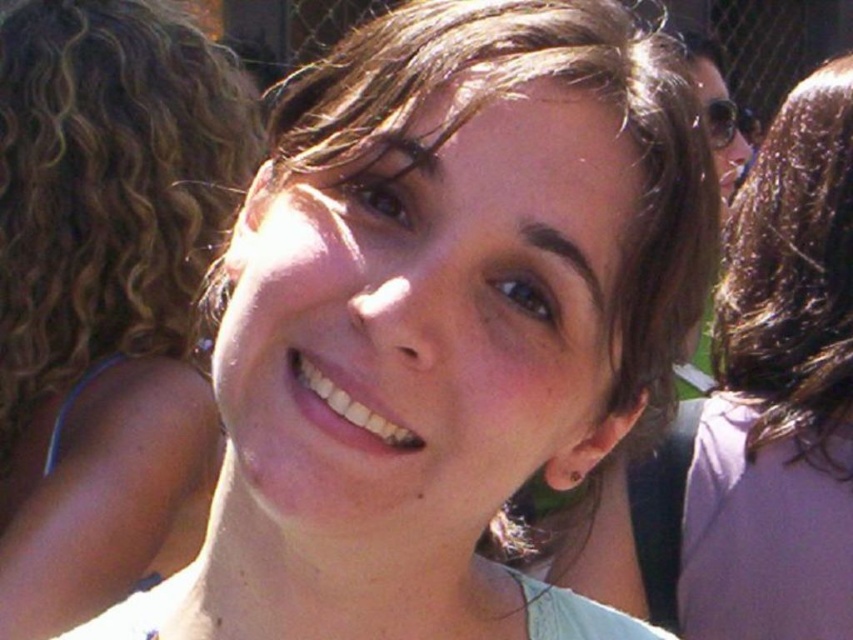
You are a photographer adjusting your camera settings to focus on the matte skin at center and the smooth brown hair at center. Which object should you focus on first to ensure proper depth of field?

The matte skin at center is closer to the viewer than the smooth brown hair at center, so you should focus on the matte skin at center first to ensure proper depth of field.

You are a photographer adjusting the focus on your camera. You notice the matte skin at center and the smooth brown hair at center in your viewfinder. Which object should you focus on if you want to capture the larger feature in the photo?

The matte skin at center has a larger size compared to the smooth brown hair at center, so you should focus on the matte skin at center to capture the larger feature.